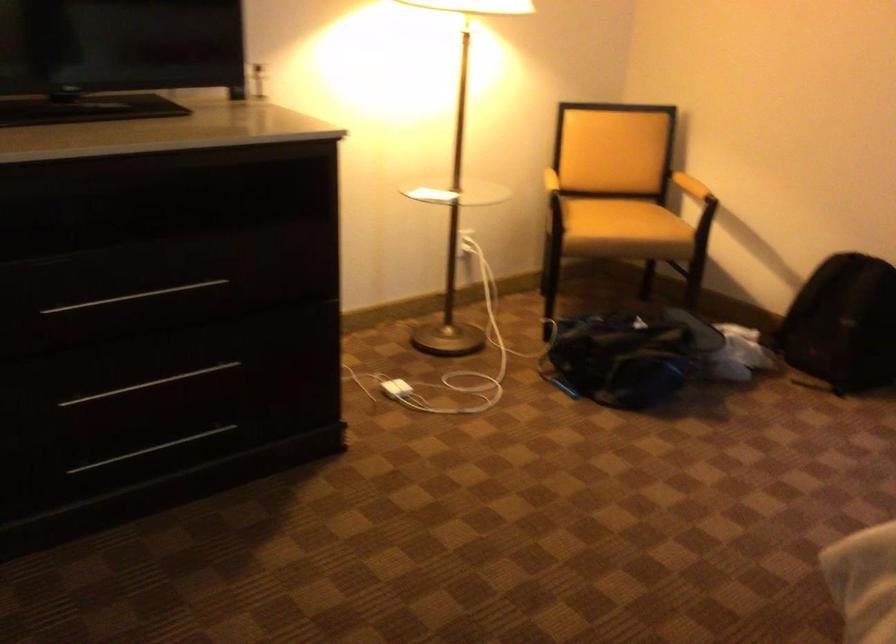
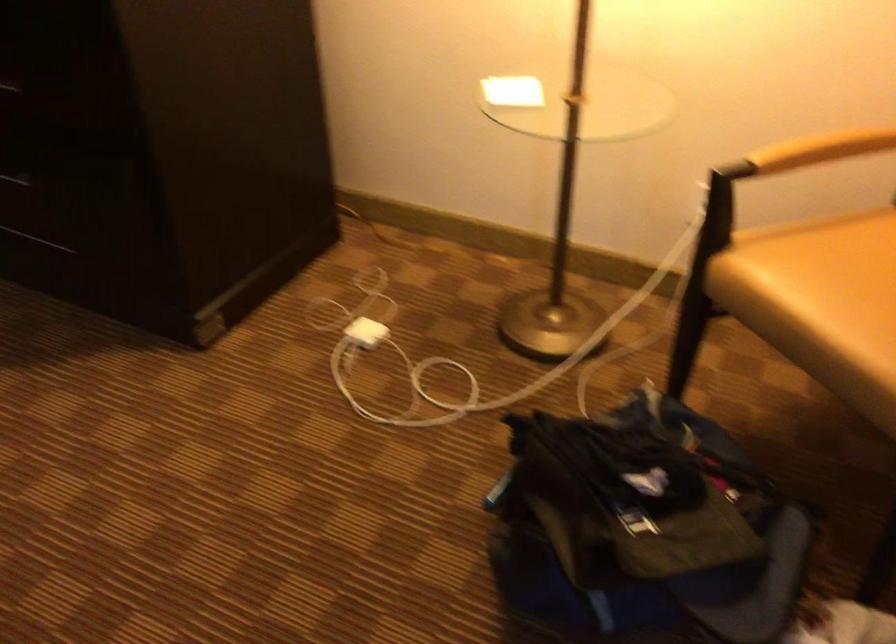
The point at (423, 193) is marked in the first image. Where is the corresponding point in the second image?

(513, 91)